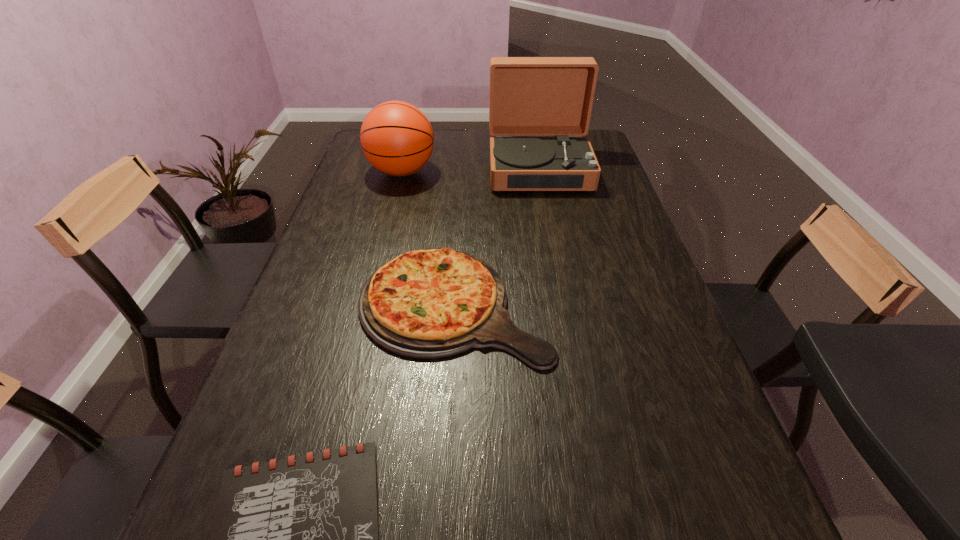
Locate an element on the screen. Image resolution: width=960 pixels, height=540 pixels. object that stands as the second closest to the third tallest object is located at coordinates coord(529,96).